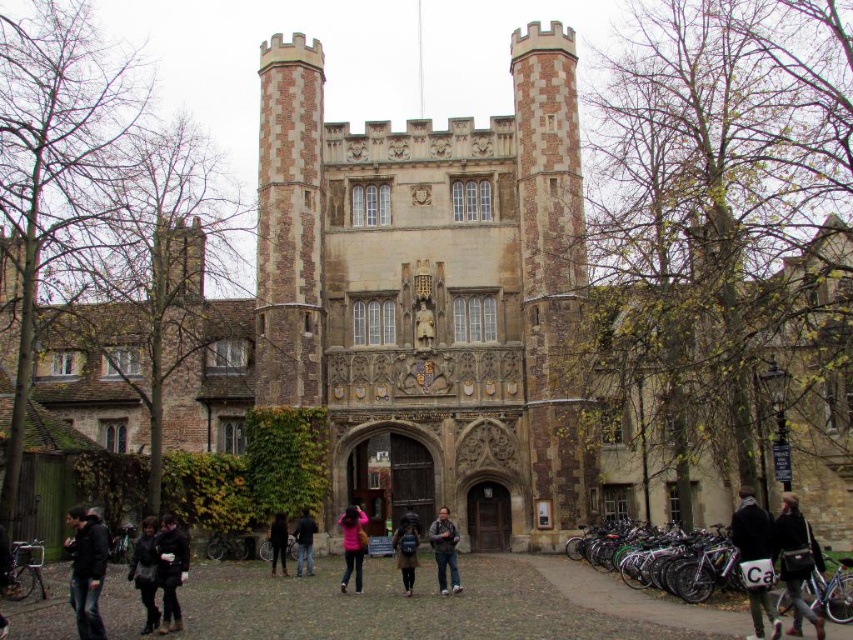
You are standing in front of a historic medieval building with two towers. You see dark gray jeans at center and pink fabric at center. Which object is positioned to the right of the other?

The dark gray jeans at center is to the right of the pink fabric at center.

You are a tour guide leading a group around the historic building. You notice two items at the lower left corner of the scene. The items are the dark brown leather jacket at lower left and the black leather coat at lower left. Your group asks if they can safely walk between these two items to reach the entrance. The path between them is 1.2 meters wide. Can they pass through comfortably?

The path between the dark brown leather jacket at lower left and the black leather coat at lower left is 1.2 meters wide. Since the average person is about 0.5 meters wide, there is enough space for them to walk through comfortably without touching either item.